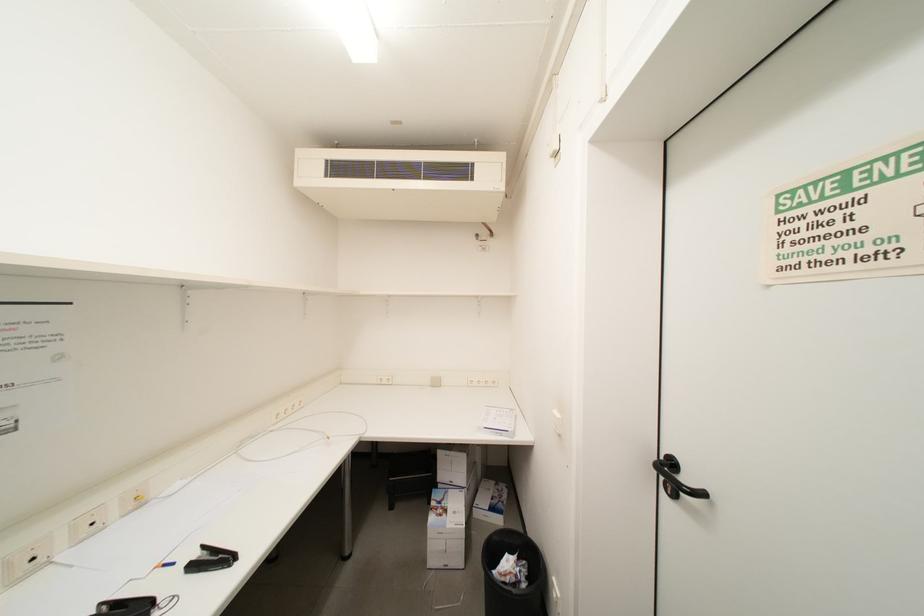
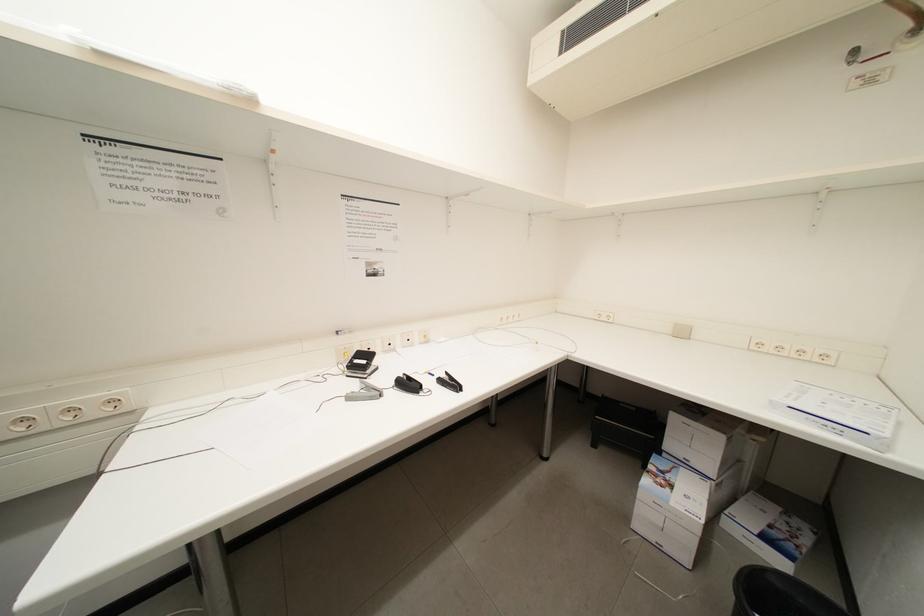
Question: The camera is either moving clockwise (left) or counter-clockwise (right) around the object. The first image is from the beginning of the video and the second image is from the end. Is the camera moving left or right when shooting the video?

Choices:
 (A) Left
 (B) Right

Answer: (B)